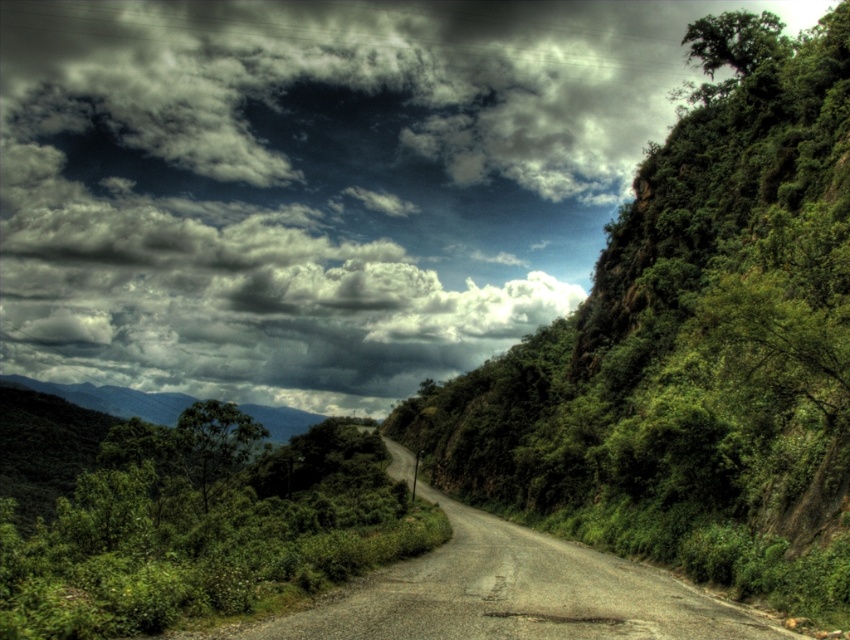
Question: Is cloudy sky at upper center further to the viewer compared to green leafy shrubs at center?

Choices:
 (A) yes
 (B) no

Answer: (A)

Question: Which point appears farthest from the camera in this image?

Choices:
 (A) (75, 332)
 (B) (468, 563)
 (C) (10, 618)

Answer: (A)

Question: Which point is farther to the camera?

Choices:
 (A) (207, 516)
 (B) (248, 630)

Answer: (A)

Question: Can you confirm if cloudy sky at upper center is thinner than green leafy shrubs at center?

Choices:
 (A) yes
 (B) no

Answer: (B)

Question: Is cloudy sky at upper center to the left of gravel road at center from the viewer's perspective?

Choices:
 (A) yes
 (B) no

Answer: (A)

Question: Based on their relative distances, which object is nearer to the cloudy sky at upper center?

Choices:
 (A) gravel road at center
 (B) green leafy shrubs at center

Answer: (B)